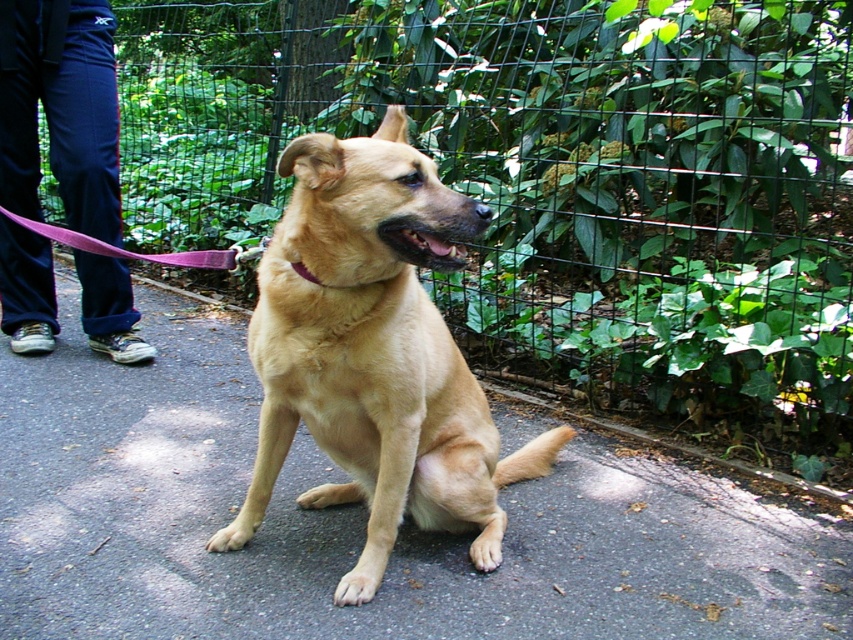
Which is in front, point (398, 163) or point (108, 339)?

Point (398, 163) is more forward.

Does golden fur dog at center have a smaller size compared to blue fabric pants at left?

Incorrect, golden fur dog at center is not smaller in size than blue fabric pants at left.

Where is `golden fur dog at center`? The width and height of the screenshot is (853, 640). golden fur dog at center is located at coordinates (375, 353).

Locate an element on the screen. Image resolution: width=853 pixels, height=640 pixels. golden fur dog at center is located at coordinates (375, 353).

In the scene shown: Is smooth asphalt pavement at center shorter than pink fabric leash at center?

No, smooth asphalt pavement at center is not shorter than pink fabric leash at center.

Between smooth asphalt pavement at center and pink fabric leash at center, which one has less height?

pink fabric leash at center

Image resolution: width=853 pixels, height=640 pixels. Describe the element at coordinates (358, 520) in the screenshot. I see `smooth asphalt pavement at center` at that location.

Find the location of a particular element. This screenshot has width=853, height=640. smooth asphalt pavement at center is located at coordinates (358, 520).

Is smooth asphalt pavement at center closer to camera compared to purple fabric neckband at center?

Yes.

Is smooth asphalt pavement at center below purple fabric neckband at center?

Yes.

Does point (668, 621) come farther from viewer compared to point (370, 280)?

That is True.

The height and width of the screenshot is (640, 853). I want to click on smooth asphalt pavement at center, so click(x=358, y=520).